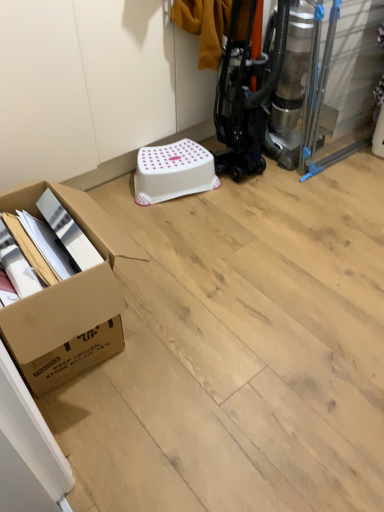
Find the location of a particular element. The width and height of the screenshot is (384, 512). unoccupied region to the right of white plastic stool at center is located at coordinates (247, 195).